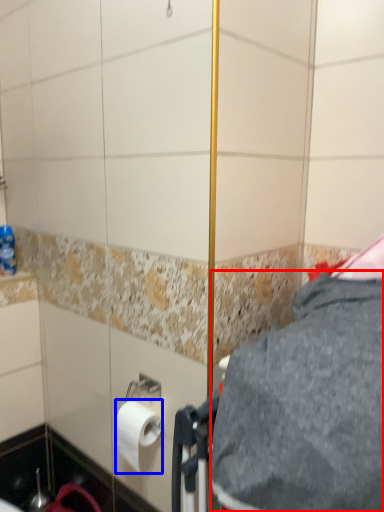
Question: Which object is closer to the camera taking this photo, gray (highlighted by a red box) or toilet paper (highlighted by a blue box)?

Choices:
 (A) gray
 (B) toilet paper

Answer: (A)